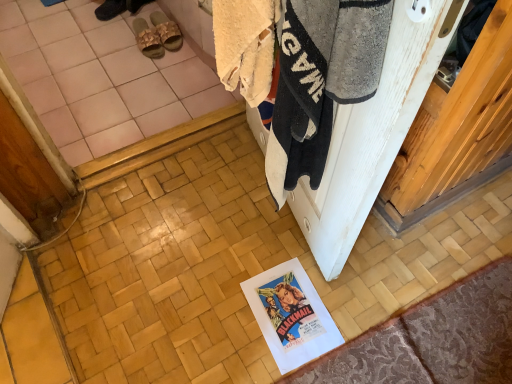
You are a GUI agent. You are given a task and a screenshot of the screen. Output one action in this format:
    pyautogui.click(x=<x>, y=<y>)
    Task: Click on the blank space above patterned fabric doormat at lower right (from a real-world perspective)
    
    Given the screenshot: What is the action you would take?
    pyautogui.click(x=441, y=339)